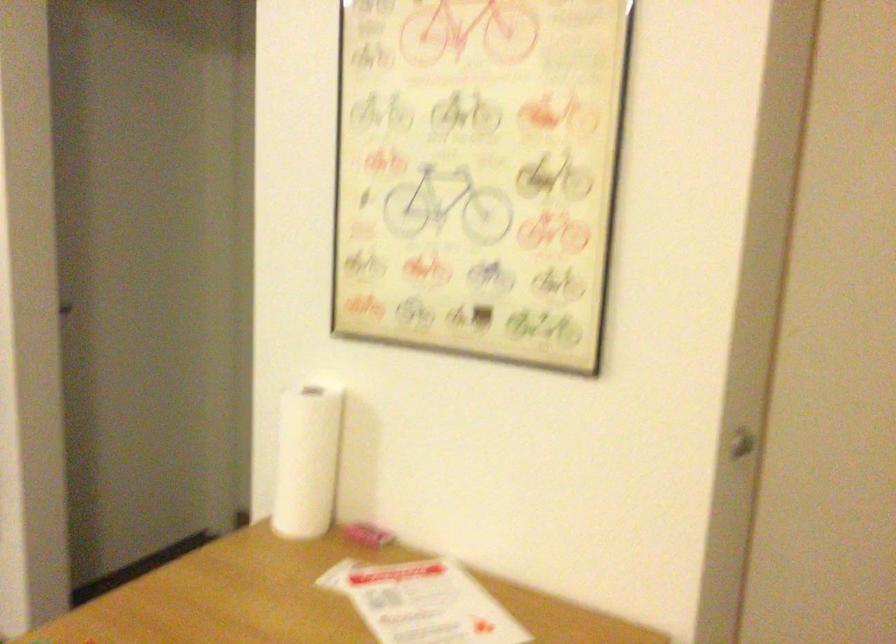
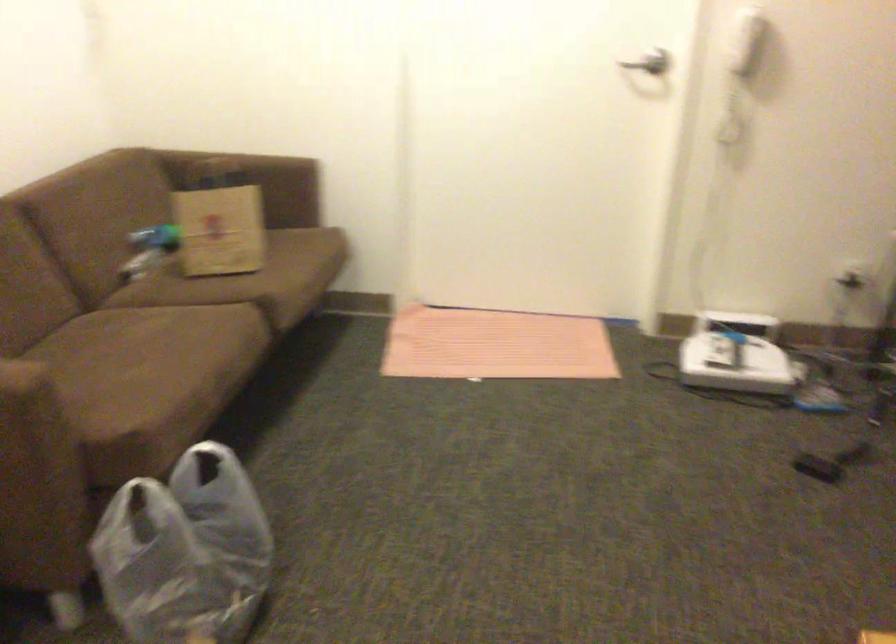
The first image is from the beginning of the video and the second image is from the end. How did the camera likely rotate when shooting the video?

The camera's rotation is toward left-down.